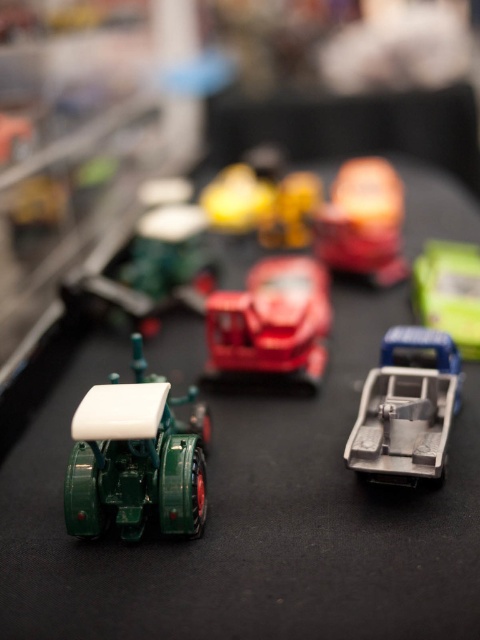
You are a child who wants to reach the green matte tractor at left on a table. Your hand can extend 30 inches from your body. Can you reach it?

The green matte tractor at left is 29.55 inches away from the viewer, so yes, the child can reach it since their hand can extend 30 inches, which is slightly longer than the distance required.

You are organizing a toy display and need to place a new toy car between the green matte tractor at left and the metallic silver tractor with black roof. According to the current layout, where should you position the new toy car to maintain the existing spatial arrangement?

The green matte tractor at left is located at point [136,458]. To maintain the existing spatial arrangement, the new toy car should be placed between these coordinates and the position of the metallic silver tractor with black roof.